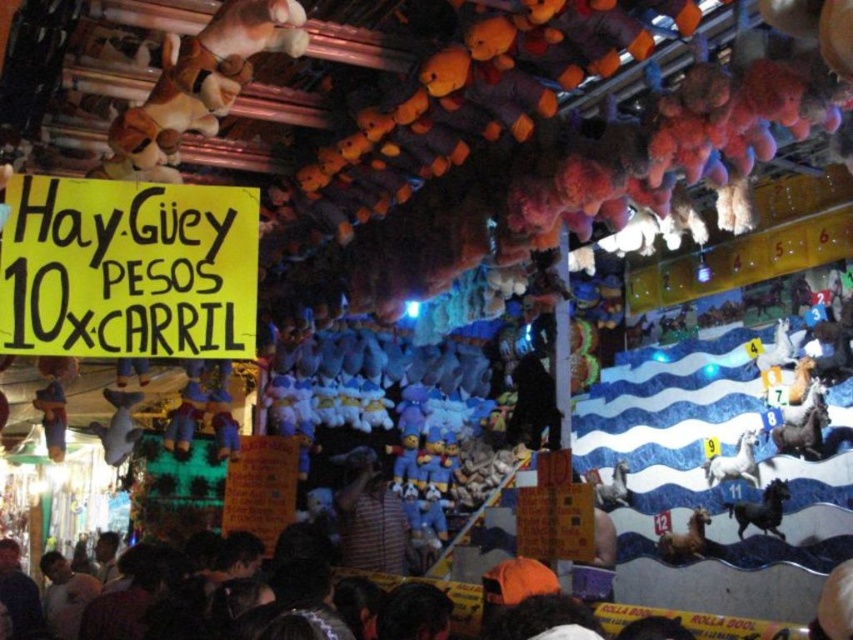
Question: Is white matte horse at lower right wider than brown matte horse at lower right?

Choices:
 (A) yes
 (B) no

Answer: (A)

Question: Is dark brown leather cap at lower left in front of brown matte horse at lower right?

Choices:
 (A) yes
 (B) no

Answer: (B)

Question: Which of the following is the closest to the observer?

Choices:
 (A) striped shirt at center
 (B) white matte horse at lower right

Answer: (B)

Question: Which object is farther from the camera taking this photo?

Choices:
 (A) black matte horse at lower right
 (B) white matte horse at lower right
 (C) striped shirt at center
 (D) brown matte horse at lower right

Answer: (C)

Question: Which point is closer to the camera?

Choices:
 (A) white matte horse at lower right
 (B) shiny metallic horse at center

Answer: (B)

Question: In this image, where is black matte horse at lower right located relative to gray felt horse at center?

Choices:
 (A) right
 (B) left

Answer: (A)